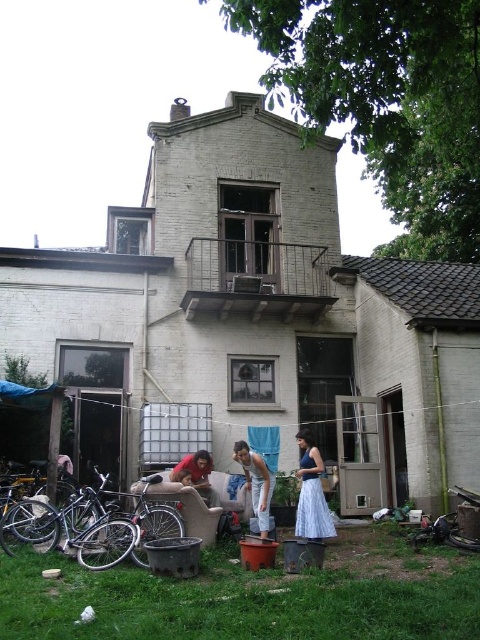
Question: Which object is closer to the camera taking this photo?

Choices:
 (A) silver metallic bicycle at lower left
 (B) metallic silver bicycle at lower right

Answer: (A)

Question: Among these points, which one is nearest to the camera?

Choices:
 (A) (133, 556)
 (B) (238, 452)

Answer: (A)

Question: Which point is farther to the camera?

Choices:
 (A) (117, 550)
 (B) (273, 604)
 (C) (70, 534)

Answer: (C)

Question: Does light blue sheer skirt at lower center have a smaller size compared to matte red shirt at center?

Choices:
 (A) yes
 (B) no

Answer: (B)

Question: Does matte brown pot at lower center appear on the right side of white cotton tank top at center?

Choices:
 (A) yes
 (B) no

Answer: (A)

Question: Is light blue sheer skirt at lower center smaller than white cotton tank top at center?

Choices:
 (A) yes
 (B) no

Answer: (B)